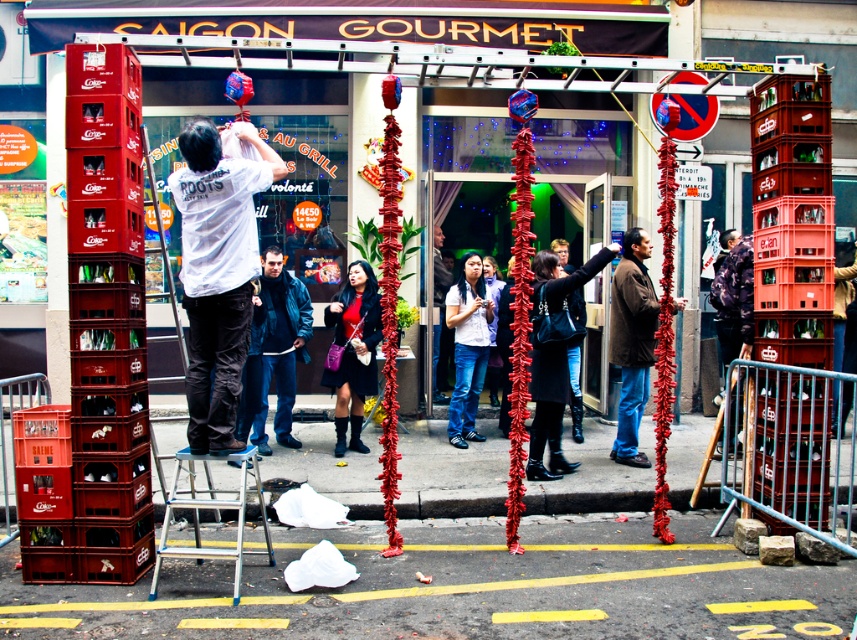
You are a customer entering the restaurant and see the brown wool coat at center and the blue matte jacket at center. Which one is closer to the entrance?

The brown wool coat at center is closer to the entrance because it is in front of the blue matte jacket at center.